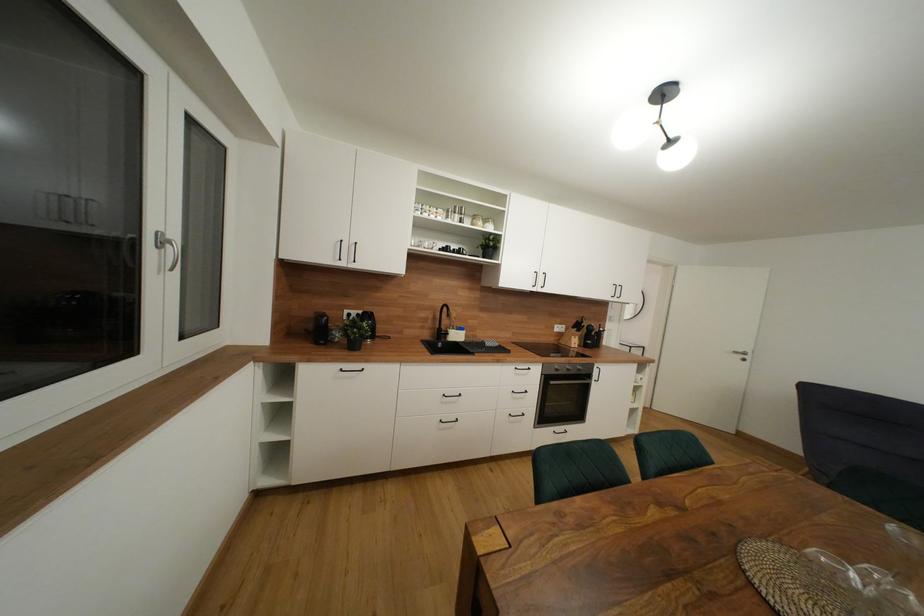
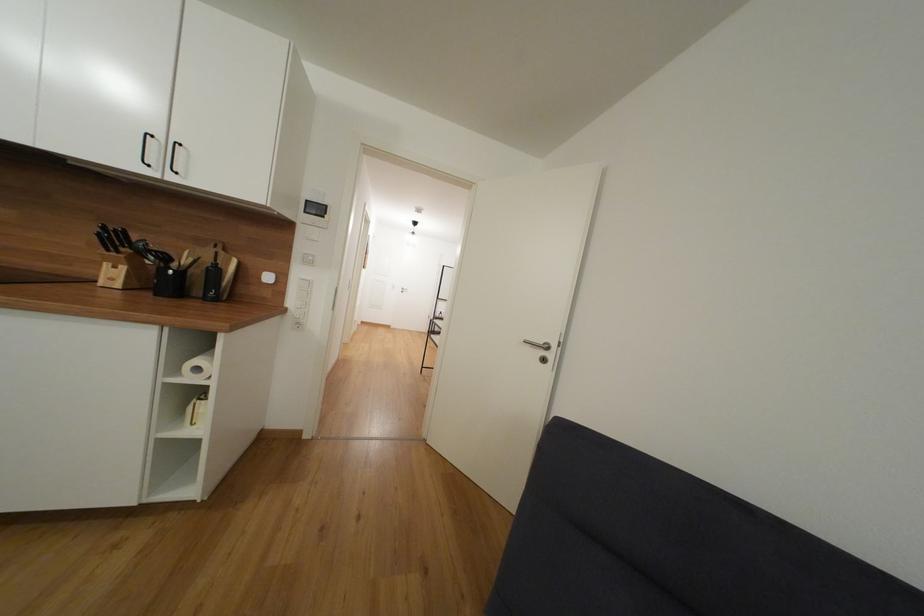
The images are taken continuously from a first-person perspective. In which direction are you moving?

The cameraman walked toward right, forward.